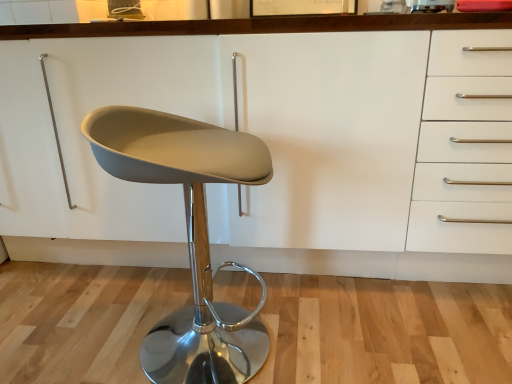
Identify the location of vacant region to the left of matte gray seat at center. This screenshot has width=512, height=384. (84, 333).